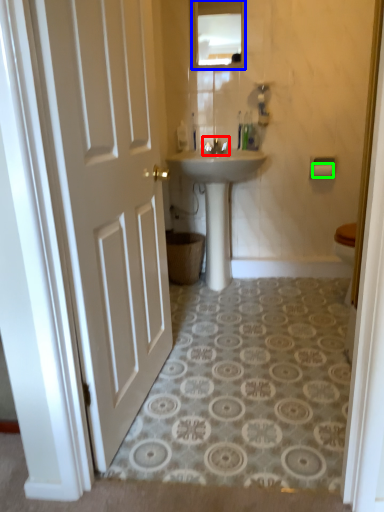
Question: Considering the real-world distances, which object is farthest from tap (highlighted by a red box)? mirror (highlighted by a blue box) or toilet paper (highlighted by a green box)?

Choices:
 (A) mirror
 (B) toilet paper

Answer: (B)